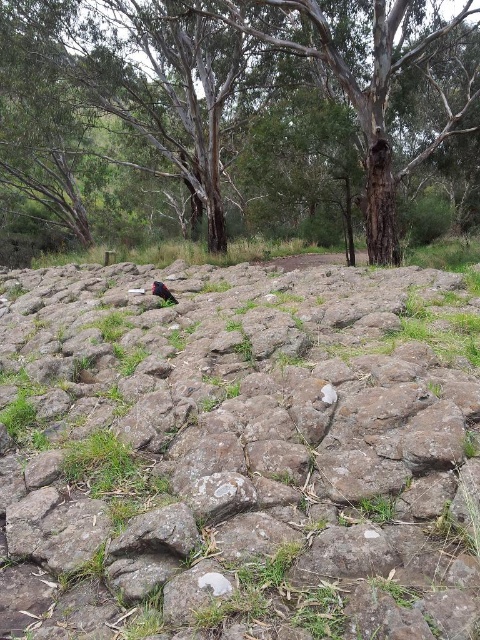
Who is positioned more to the left, rough textured rock at center or shiny black bird at center?

shiny black bird at center

Is rough textured rock at center thinner than shiny black bird at center?

Incorrect, rough textured rock at center's width is not less than shiny black bird at center's.

Between point (247, 598) and point (159, 284), which one is positioned in front?

Positioned in front is point (247, 598).

Where is `rough textured rock at center`? This screenshot has height=640, width=480. rough textured rock at center is located at coordinates (239, 454).

Does rough textured rock at center have a greater width compared to brown textured tree at upper center?

Incorrect, rough textured rock at center's width does not surpass brown textured tree at upper center's.

Who is positioned more to the left, rough textured rock at center or brown textured tree at upper center?

brown textured tree at upper center is more to the left.

The width and height of the screenshot is (480, 640). Describe the element at coordinates (239, 454) in the screenshot. I see `rough textured rock at center` at that location.

Find the location of `rough textured rock at center`. rough textured rock at center is located at coordinates (239, 454).

Does brown textured tree at upper center have a greater width compared to shiny black bird at center?

Yes, brown textured tree at upper center is wider than shiny black bird at center.

Can you confirm if brown textured tree at upper center is positioned to the left of shiny black bird at center?

Correct, you'll find brown textured tree at upper center to the left of shiny black bird at center.

Describe the element at coordinates (239, 102) in the screenshot. I see `brown textured tree at upper center` at that location.

Image resolution: width=480 pixels, height=640 pixels. In order to click on brown textured tree at upper center in this screenshot , I will do `click(239, 102)`.